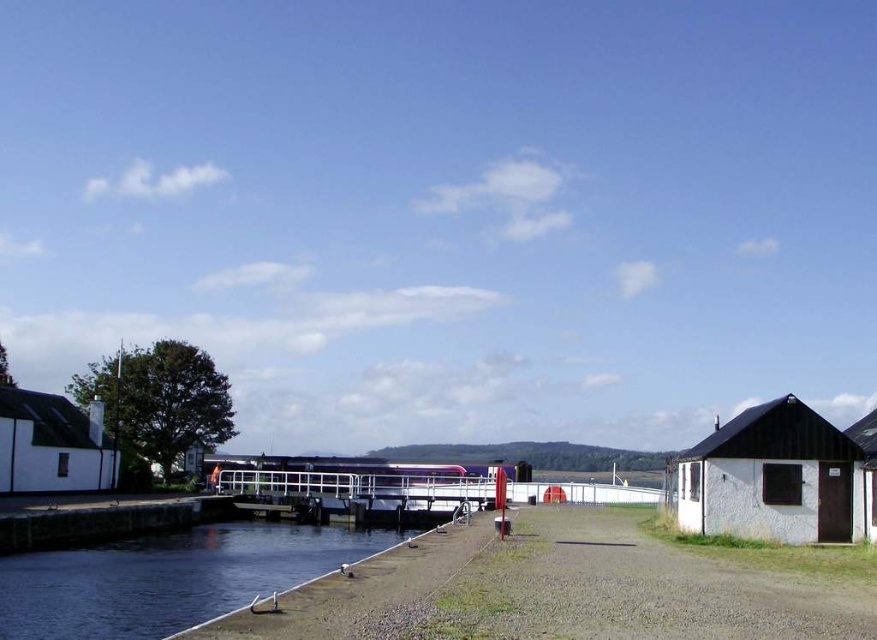
At what (x,y) coordinates should I click in order to perform the action: click on smooth concrete river at lower left. Please return your answer as a coordinate pair (x, y). Looking at the image, I should click on (168, 577).

Who is positioned more to the left, smooth concrete river at lower left or white stone hut at lower right?

From the viewer's perspective, smooth concrete river at lower left appears more on the left side.

Which is behind, point (58, 616) or point (738, 529)?

Point (738, 529)

You are a GUI agent. You are given a task and a screenshot of the screen. Output one action in this format:
    pyautogui.click(x=<x>, y=<y>)
    Task: Click on the smooth concrete river at lower left
    The height and width of the screenshot is (640, 877).
    Given the screenshot: What is the action you would take?
    pyautogui.click(x=168, y=577)

Between white matte hut at left and white matte hut at right, which one appears on the left side from the viewer's perspective?

Positioned to the left is white matte hut at left.

Is point (98, 438) positioned in front of point (864, 422)?

No, (98, 438) is further to viewer.

Which is behind, point (101, 452) or point (868, 445)?

Point (101, 452)

At what (x,y) coordinates should I click in order to perform the action: click on white matte hut at left. Please return your answer as a coordinate pair (x, y). The height and width of the screenshot is (640, 877). Looking at the image, I should click on (52, 444).

Is smooth concrete river at lower left shorter than white matte hut at right?

Yes.

Describe the element at coordinates (168, 577) in the screenshot. I see `smooth concrete river at lower left` at that location.

The height and width of the screenshot is (640, 877). Identify the location of smooth concrete river at lower left. (168, 577).

The image size is (877, 640). Find the location of `smooth concrete river at lower left`. smooth concrete river at lower left is located at coordinates (168, 577).